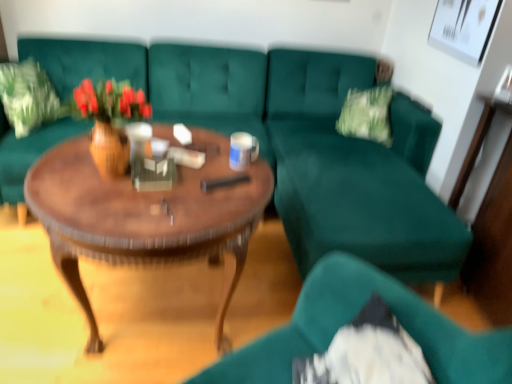
Question: Is wooden polished coffee table at center outside green fabric pillow at upper left?

Choices:
 (A) yes
 (B) no

Answer: (A)

Question: Does wooden polished coffee table at center appear on the right side of green fabric pillow at upper left?

Choices:
 (A) no
 (B) yes

Answer: (B)

Question: Can you confirm if wooden polished coffee table at center is thinner than green fabric pillow at upper left?

Choices:
 (A) yes
 (B) no

Answer: (B)

Question: Does wooden polished coffee table at center turn towards green fabric pillow at upper left?

Choices:
 (A) no
 (B) yes

Answer: (A)

Question: Does wooden polished coffee table at center have a greater height compared to green fabric pillow at upper left?

Choices:
 (A) no
 (B) yes

Answer: (B)

Question: Does wooden polished coffee table at center have a greater width compared to green fabric pillow at upper left?

Choices:
 (A) no
 (B) yes

Answer: (B)

Question: From the image's perspective, is wooden vase with flowers at center over wooden polished coffee table at center?

Choices:
 (A) no
 (B) yes

Answer: (B)

Question: Can you confirm if wooden vase with flowers at center is smaller than wooden polished coffee table at center?

Choices:
 (A) no
 (B) yes

Answer: (B)

Question: Could you tell me if wooden vase with flowers at center is facing wooden polished coffee table at center?

Choices:
 (A) no
 (B) yes

Answer: (A)

Question: Are wooden vase with flowers at center and wooden polished coffee table at center located far from each other?

Choices:
 (A) no
 (B) yes

Answer: (A)

Question: From a real-world perspective, is wooden vase with flowers at center located beneath wooden polished coffee table at center?

Choices:
 (A) no
 (B) yes

Answer: (A)

Question: Considering the relative sizes of wooden vase with flowers at center and wooden polished coffee table at center in the image provided, is wooden vase with flowers at center taller than wooden polished coffee table at center?

Choices:
 (A) no
 (B) yes

Answer: (A)

Question: Is wooden polished coffee table at center outside wooden vase with flowers at center?

Choices:
 (A) yes
 (B) no

Answer: (A)